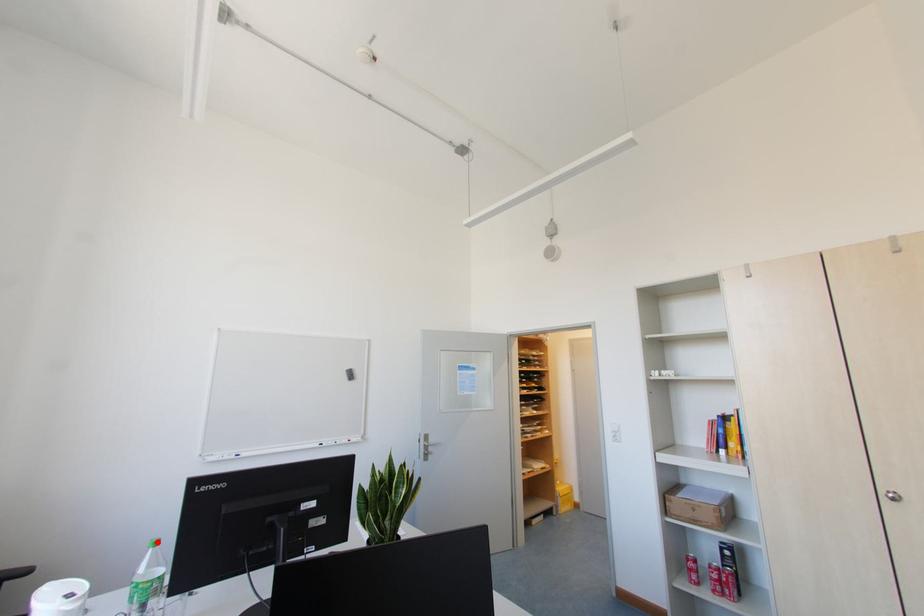
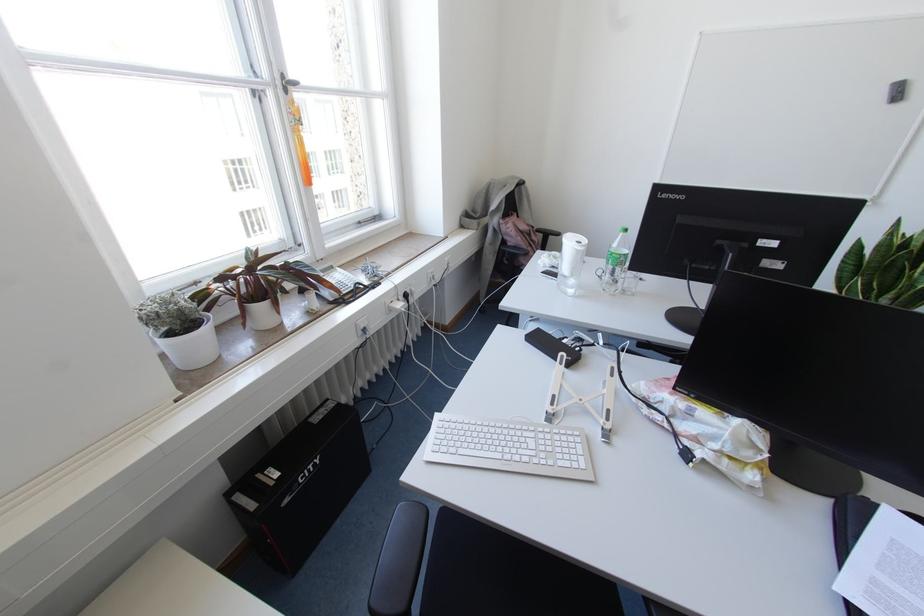
Locate, in the second image, the point that corresponds to the highlighted location in the first image.

(625, 229)